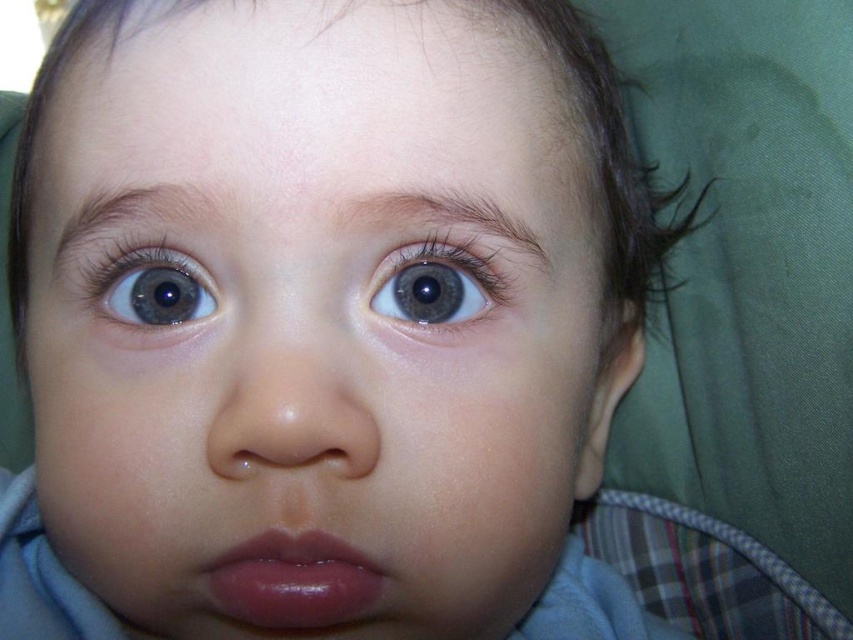
You are a photographer adjusting the focus on your camera. You want to ensure both the glossy pink lips at center and the blue glossy eye at upper center are in focus. Which object should you focus on first to achieve this?

You should focus on the glossy pink lips at center first because it is closer to the viewer than the blue glossy eye at upper center. By focusing on the closer object, the farther one will also come into focus if within the depth of field.

You are a photographer adjusting the focus on your camera. You want to ensure that both the glossy pink lips at center and the blue glossy eye at upper left are in sharp focus. Given that your camera can focus sharply within a 3 inch range, will both objects be in focus?

The distance between the glossy pink lips at center and the blue glossy eye at upper left is 3.10 inches, which exceeds the camera focus range of 3 inches. Therefore, both objects cannot be in sharp focus simultaneously.

Where is the smooth skin face at center located in the image?

The smooth skin face at center is located at point (315, 320) in the image.